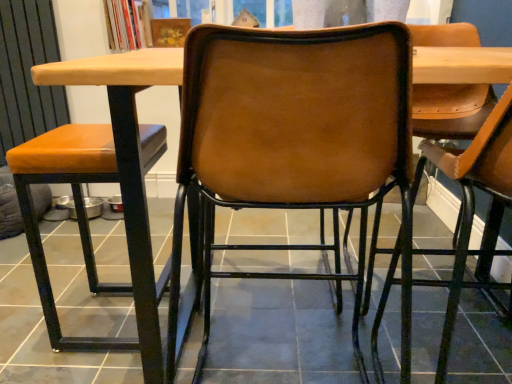
Question: From the image's perspective, is leather-like brown chair at center, marked as the 1th chair in a right-to-left arrangement, under brown leather chair at center, which is the 2th chair from right to left?

Choices:
 (A) no
 (B) yes

Answer: (B)

Question: Does leather-like brown chair at center, acting as the third chair starting from the left, have a lesser width compared to brown leather chair at center, which is the 2th chair from right to left?

Choices:
 (A) yes
 (B) no

Answer: (A)

Question: Can you confirm if leather-like brown chair at center, acting as the third chair starting from the left, is taller than brown leather chair at center, which is the 2th chair from right to left?

Choices:
 (A) yes
 (B) no

Answer: (A)

Question: From a real-world perspective, is leather-like brown chair at center, acting as the third chair starting from the left, on brown leather chair at center, which is the 2th chair from right to left?

Choices:
 (A) yes
 (B) no

Answer: (A)

Question: Does leather-like brown chair at center, acting as the third chair starting from the left, turn towards brown leather chair at center, which is the 2th chair from right to left?

Choices:
 (A) yes
 (B) no

Answer: (B)

Question: Is brown leather chair at center, which is the 2th chair from right to left, situated inside orange leather stool at left, the 3th chair viewed from the right, or outside?

Choices:
 (A) outside
 (B) inside

Answer: (A)

Question: Does point (196, 114) appear closer or farther from the camera than point (180, 69)?

Choices:
 (A) farther
 (B) closer

Answer: (B)

Question: In terms of width, does brown leather chair at center, which is the 2th chair from right to left, look wider or thinner when compared to orange leather stool at left, the 3th chair viewed from the right?

Choices:
 (A) thin
 (B) wide

Answer: (B)

Question: From the image's perspective, is brown leather chair at center, which is the 2th chair from right to left, above or below orange leather stool at left, the 3th chair viewed from the right?

Choices:
 (A) above
 (B) below

Answer: (A)

Question: From a real-world perspective, is leather-like brown chair at center, acting as the third chair starting from the left, physically located above or below matte brown tile at center?

Choices:
 (A) below
 (B) above

Answer: (B)

Question: Is leather-like brown chair at center, acting as the third chair starting from the left, taller or shorter than matte brown tile at center?

Choices:
 (A) short
 (B) tall

Answer: (B)

Question: From the image's perspective, is leather-like brown chair at center, acting as the third chair starting from the left, located above or below matte brown tile at center?

Choices:
 (A) below
 (B) above

Answer: (B)

Question: In the image, is leather-like brown chair at center, acting as the third chair starting from the left, on the left side or the right side of matte brown tile at center?

Choices:
 (A) right
 (B) left

Answer: (A)

Question: From the image's perspective, relative to orange leather stool at left, which is the 1th chair from left to right, is matte brown tile at center above or below?

Choices:
 (A) above
 (B) below

Answer: (B)

Question: Is point (479, 309) closer or farther from the camera than point (117, 344)?

Choices:
 (A) closer
 (B) farther

Answer: (B)